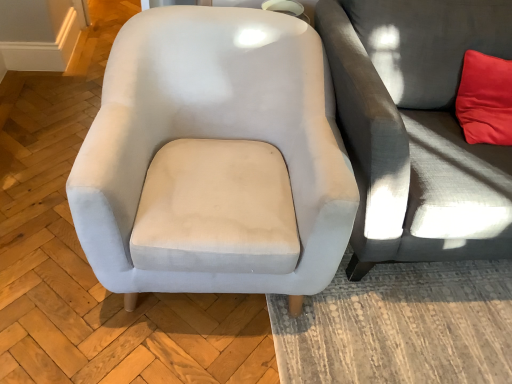
Locate an element on the screen. Image resolution: width=512 pixels, height=384 pixels. free location to the left of satin light gray armchair at center is located at coordinates (44, 210).